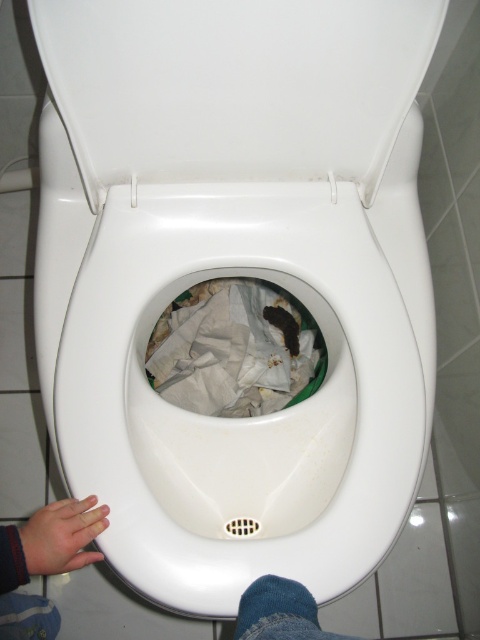
Between point (191, 29) and point (201, 296), which one is positioned in front?

Positioned in front is point (191, 29).

Is the position of white glossy toilet lid at upper center more distant than that of white crumpled paper at center?

No, it is not.

Does point (314, 131) come behind point (218, 289)?

No, it is not.

The height and width of the screenshot is (640, 480). What are the coordinates of `white glossy toilet lid at upper center` in the screenshot? It's located at (233, 86).

Can you confirm if white crumpled paper at center is positioned to the right of skinny hand at lower left?

Yes, white crumpled paper at center is to the right of skinny hand at lower left.

This screenshot has width=480, height=640. What are the coordinates of `white crumpled paper at center` in the screenshot? It's located at tap(235, 349).

Is point (222, 413) positioned after point (96, 518)?

Yes, point (222, 413) is farther from viewer.

Identify the location of white crumpled paper at center. (x=235, y=349).

Based on the photo, how distant is white glossy toilet lid at upper center from skinny hand at lower left?

46.03 centimeters

Can you confirm if white glossy toilet lid at upper center is smaller than skinny hand at lower left?

No.

Between point (179, 83) and point (80, 502), which one is positioned in front?

Point (179, 83) is in front.

At what (x,y) coordinates should I click in order to perform the action: click on white glossy toilet lid at upper center. Please return your answer as a coordinate pair (x, y). Looking at the image, I should click on (233, 86).